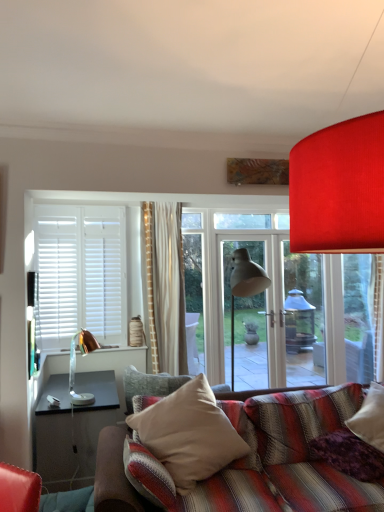
What do you see at coordinates (349, 455) in the screenshot? This screenshot has width=384, height=512. I see `purple soft pillow at lower right, the second pillow from the left` at bounding box center [349, 455].

What do you see at coordinates (189, 434) in the screenshot? Image resolution: width=384 pixels, height=512 pixels. I see `beige fabric pillow at center, marked as the 2th pillow in a right-to-left arrangement` at bounding box center [189, 434].

Image resolution: width=384 pixels, height=512 pixels. What do you see at coordinates (75, 365) in the screenshot?
I see `copper metallic table lamp at left` at bounding box center [75, 365].

Identify the location of copper metallic table lamp at left. This screenshot has width=384, height=512. (75, 365).

The height and width of the screenshot is (512, 384). In order to click on purple soft pillow at lower right, which appears as the first pillow when viewed from the right in this screenshot , I will do `click(349, 455)`.

Is purple soft pillow at lower right, which appears as the first pillow when viewed from the right, wider or thinner than copper metallic table lamp at left?

Clearly, purple soft pillow at lower right, which appears as the first pillow when viewed from the right, has more width compared to copper metallic table lamp at left.

Which is nearer, (317, 444) or (90, 349)?

The point (317, 444) is closer.

From a real-world perspective, is purple soft pillow at lower right, the second pillow from the left, located higher than copper metallic table lamp at left?

No.

Locate an element on the screen. The image size is (384, 512). table lamp above the purple soft pillow at lower right, the second pillow from the left (from a real-world perspective) is located at coordinates (75, 365).

Is copper metallic table lamp at left inside or outside of beige fabric pillow at center, marked as the 2th pillow in a right-to-left arrangement?

The correct answer is: outside.

In terms of size, does copper metallic table lamp at left appear bigger or smaller than beige fabric pillow at center, which is the 1th pillow in left-to-right order?

In the image, copper metallic table lamp at left appears to be smaller than beige fabric pillow at center, which is the 1th pillow in left-to-right order.

From a real-world perspective, is copper metallic table lamp at left positioned over beige fabric pillow at center, which is the 1th pillow in left-to-right order, based on gravity?

Yes.

Between copper metallic table lamp at left and beige fabric pillow at center, marked as the 2th pillow in a right-to-left arrangement, which one appears on the left side from the viewer's perspective?

Positioned to the left is copper metallic table lamp at left.

Considering the relative positions of beige fabric pillow at center, which is the 1th pillow in left-to-right order, and copper metallic table lamp at left in the image provided, is beige fabric pillow at center, which is the 1th pillow in left-to-right order, to the left or to the right of copper metallic table lamp at left?

beige fabric pillow at center, which is the 1th pillow in left-to-right order, is to the right of copper metallic table lamp at left.

Consider the image. Could you tell me if beige fabric pillow at center, marked as the 2th pillow in a right-to-left arrangement, is facing copper metallic table lamp at left?

No, beige fabric pillow at center, marked as the 2th pillow in a right-to-left arrangement, is not turned towards copper metallic table lamp at left.

Is beige fabric pillow at center, which is the 1th pillow in left-to-right order, further to camera compared to copper metallic table lamp at left?

No, beige fabric pillow at center, which is the 1th pillow in left-to-right order, is in front of copper metallic table lamp at left.

Could copper metallic table lamp at left be considered to be inside beige fabric pillow at center, marked as the 2th pillow in a right-to-left arrangement?

That's incorrect, copper metallic table lamp at left is not inside beige fabric pillow at center, marked as the 2th pillow in a right-to-left arrangement.

Considering the relative sizes of purple soft pillow at lower right, the second pillow from the left, and beige fabric pillow at center, marked as the 2th pillow in a right-to-left arrangement, in the image provided, is purple soft pillow at lower right, the second pillow from the left, wider than beige fabric pillow at center, marked as the 2th pillow in a right-to-left arrangement,?

Incorrect, the width of purple soft pillow at lower right, the second pillow from the left, does not surpass that of beige fabric pillow at center, marked as the 2th pillow in a right-to-left arrangement.

From a real-world perspective, relative to beige fabric pillow at center, which is the 1th pillow in left-to-right order, is purple soft pillow at lower right, the second pillow from the left, vertically above or below?

Clearly, from a real-world perspective, purple soft pillow at lower right, the second pillow from the left, is below beige fabric pillow at center, which is the 1th pillow in left-to-right order.

Is purple soft pillow at lower right, the second pillow from the left, positioned beyond the bounds of beige fabric pillow at center, which is the 1th pillow in left-to-right order?

Absolutely, purple soft pillow at lower right, the second pillow from the left, is external to beige fabric pillow at center, which is the 1th pillow in left-to-right order.

Is purple soft pillow at lower right, the second pillow from the left, behind beige fabric pillow at center, which is the 1th pillow in left-to-right order?

Yes, purple soft pillow at lower right, the second pillow from the left, is further from the camera.

Is beige fabric pillow at center, marked as the 2th pillow in a right-to-left arrangement, placed right next to purple soft pillow at lower right, the second pillow from the left?

beige fabric pillow at center, marked as the 2th pillow in a right-to-left arrangement, and purple soft pillow at lower right, the second pillow from the left, are clearly separated.

Is beige fabric pillow at center, marked as the 2th pillow in a right-to-left arrangement, surrounding purple soft pillow at lower right, which appears as the first pillow when viewed from the right?

Actually, purple soft pillow at lower right, which appears as the first pillow when viewed from the right, is outside beige fabric pillow at center, marked as the 2th pillow in a right-to-left arrangement.

Between point (222, 411) and point (364, 450), which one is positioned behind?

Point (222, 411)

From a real-world perspective, which object stands above the other?

In real-world perspective, beige fabric pillow at center, marked as the 2th pillow in a right-to-left arrangement, is above.

How many degrees apart are the facing directions of copper metallic table lamp at left and purple soft pillow at lower right, the second pillow from the left?

They differ by 64.5 degrees in their facing directions.

Starting from the copper metallic table lamp at left, which pillow is the 2nd one to the right? Please provide its 2D coordinates.

[(349, 455)]

Does point (73, 358) come closer to viewer compared to point (347, 460)?

That is False.

Can you confirm if copper metallic table lamp at left is thinner than purple soft pillow at lower right, the second pillow from the left?

Yes, copper metallic table lamp at left is thinner than purple soft pillow at lower right, the second pillow from the left.

Starting from the copper metallic table lamp at left, which pillow is the 1st one in front? Please provide its 2D coordinates.

[(349, 455)]

From the image's perspective, count 1st pillows downward from the copper metallic table lamp at left and point to it. Please provide its 2D coordinates.

[(189, 434)]

From the image, which object appears to be farther from copper metallic table lamp at left, beige fabric pillow at center, which is the 1th pillow in left-to-right order, or purple soft pillow at lower right, the second pillow from the left?

purple soft pillow at lower right, the second pillow from the left, is further to copper metallic table lamp at left.

Consider the image. When comparing their distances from beige fabric pillow at center, marked as the 2th pillow in a right-to-left arrangement, does purple soft pillow at lower right, which appears as the first pillow when viewed from the right, or copper metallic table lamp at left seem closer?

purple soft pillow at lower right, which appears as the first pillow when viewed from the right, lies closer to beige fabric pillow at center, marked as the 2th pillow in a right-to-left arrangement, than the other object.

Looking at the image, which one is located further to purple soft pillow at lower right, which appears as the first pillow when viewed from the right, beige fabric pillow at center, which is the 1th pillow in left-to-right order, or copper metallic table lamp at left?

copper metallic table lamp at left lies further to purple soft pillow at lower right, which appears as the first pillow when viewed from the right, than the other object.

When comparing their distances from beige fabric pillow at center, marked as the 2th pillow in a right-to-left arrangement, does copper metallic table lamp at left or purple soft pillow at lower right, which appears as the first pillow when viewed from the right, seem closer?

purple soft pillow at lower right, which appears as the first pillow when viewed from the right, is positioned closer to the anchor beige fabric pillow at center, marked as the 2th pillow in a right-to-left arrangement.

When comparing their distances from purple soft pillow at lower right, which appears as the first pillow when viewed from the right, does copper metallic table lamp at left or beige fabric pillow at center, which is the 1th pillow in left-to-right order, seem further?

copper metallic table lamp at left.

Looking at this image, from the image, which object appears to be farther from copper metallic table lamp at left, purple soft pillow at lower right, the second pillow from the left, or beige fabric pillow at center, marked as the 2th pillow in a right-to-left arrangement?

purple soft pillow at lower right, the second pillow from the left, is further to copper metallic table lamp at left.

This screenshot has height=512, width=384. In order to click on pillow between copper metallic table lamp at left and purple soft pillow at lower right, which appears as the first pillow when viewed from the right, from left to right in this screenshot , I will do `click(189, 434)`.